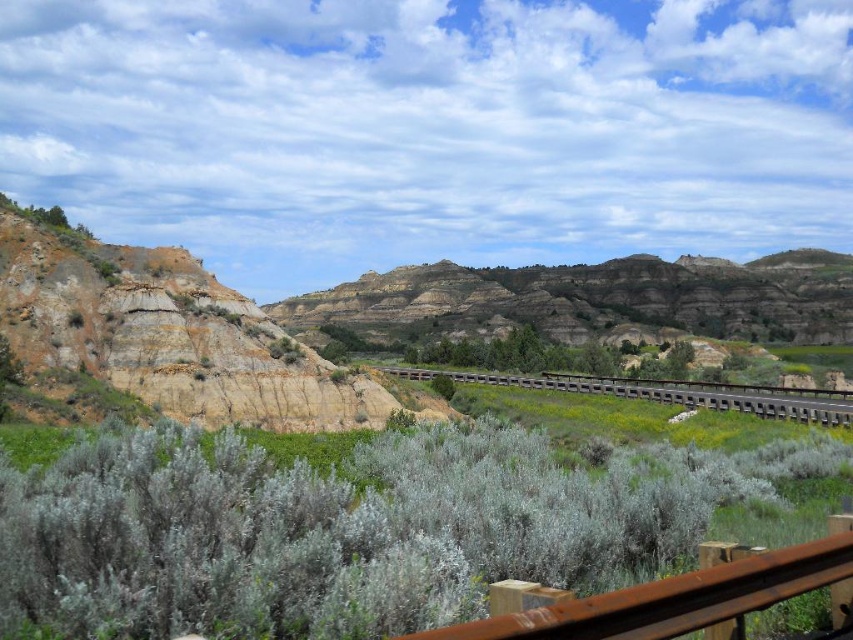
Question: Which object is closer to the camera taking this photo?

Choices:
 (A) rustic brown rock formation at center
 (B) green fuzzy bush at center
 (C) brown wooden rail at center

Answer: (B)

Question: Can you confirm if green fuzzy bush at center is positioned to the left of brown wooden rail at center?

Choices:
 (A) yes
 (B) no

Answer: (A)

Question: Does rusty metal rail at lower right appear over brown wooden rail at center?

Choices:
 (A) no
 (B) yes

Answer: (B)

Question: Which of the following is the closest to the observer?

Choices:
 (A) rusty metal rail at lower right
 (B) rustic brown rock formation at center
 (C) brown wooden rail at center

Answer: (A)

Question: Which point is closer to the camera?

Choices:
 (A) (180, 490)
 (B) (527, 381)
 (C) (440, 333)
 (D) (840, 552)

Answer: (D)

Question: Considering the relative positions of green fuzzy bush at center and rustic brown rock formation at center in the image provided, where is green fuzzy bush at center located with respect to rustic brown rock formation at center?

Choices:
 (A) above
 (B) below

Answer: (B)